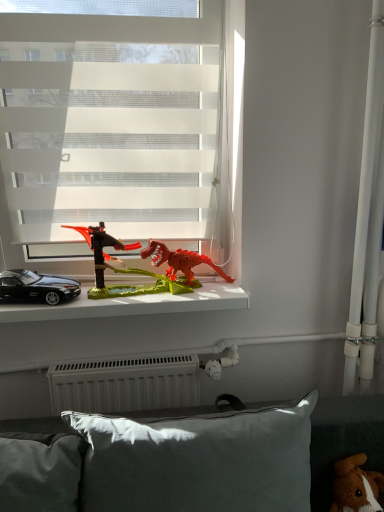
Where is `vacant area located to the right-hand side of black matte car at left`? vacant area located to the right-hand side of black matte car at left is located at coordinates click(x=102, y=295).